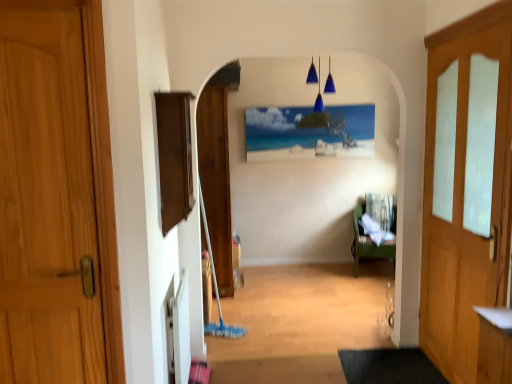
Question: Could green wicker chair at center-right be considered to be inside wooden door at center, the 1th door positioned from the back?

Choices:
 (A) yes
 (B) no

Answer: (B)

Question: Is wooden door at center, which ranks as the second door in left-to-right order, behind green wicker chair at center-right?

Choices:
 (A) no
 (B) yes

Answer: (A)

Question: Is wooden door at center, the 1th door positioned from the back, looking in the opposite direction of green wicker chair at center-right?

Choices:
 (A) no
 (B) yes

Answer: (A)

Question: Is the depth of wooden door at center, which is counted as the second door, starting from the right, less than that of green wicker chair at center-right?

Choices:
 (A) yes
 (B) no

Answer: (A)

Question: Considering the relative positions of wooden door at center, the 1th door positioned from the back, and green wicker chair at center-right in the image provided, is wooden door at center, the 1th door positioned from the back, to the left of green wicker chair at center-right from the viewer's perspective?

Choices:
 (A) yes
 (B) no

Answer: (A)

Question: Looking at the image, does wooden door at center, which appears as the 3th door when viewed from the front, seem bigger or smaller compared to dark gray rubber doormat at lower center?

Choices:
 (A) big
 (B) small

Answer: (A)

Question: From a real-world perspective, relative to dark gray rubber doormat at lower center, is wooden door at center, the 1th door positioned from the back, vertically above or below?

Choices:
 (A) above
 (B) below

Answer: (A)

Question: Is point (202, 243) positioned closer to the camera than point (366, 370)?

Choices:
 (A) closer
 (B) farther

Answer: (B)

Question: Is wooden door at center, which appears as the 3th door when viewed from the front, wider or thinner than dark gray rubber doormat at lower center?

Choices:
 (A) wide
 (B) thin

Answer: (B)

Question: From their relative heights in the image, would you say wooden door at center, which appears as the 3th door when viewed from the front, is taller or shorter than wooden door at left, which ranks as the first door in front-to-back order?

Choices:
 (A) tall
 (B) short

Answer: (A)

Question: In the image, is wooden door at center, which ranks as the second door in left-to-right order, on the left side or the right side of wooden door at left, which is the third door from back to front?

Choices:
 (A) right
 (B) left

Answer: (A)

Question: From the image's perspective, is wooden door at center, which appears as the 3th door when viewed from the front, located above or below wooden door at left, the 3th door when ordered from right to left?

Choices:
 (A) below
 (B) above

Answer: (B)

Question: From a real-world perspective, is wooden door at center, which is counted as the second door, starting from the right, above or below wooden door at left, which is the third door from back to front?

Choices:
 (A) above
 (B) below

Answer: (B)

Question: From a real-world perspective, is wooden door at left, which ranks as the first door in front-to-back order, above or below wooden door at right, the third door viewed from the left?

Choices:
 (A) above
 (B) below

Answer: (A)

Question: Is wooden door at left, which is the third door from back to front, in front of or behind wooden door at right, which ranks as the second door in front-to-back order, in the image?

Choices:
 (A) behind
 (B) front

Answer: (B)